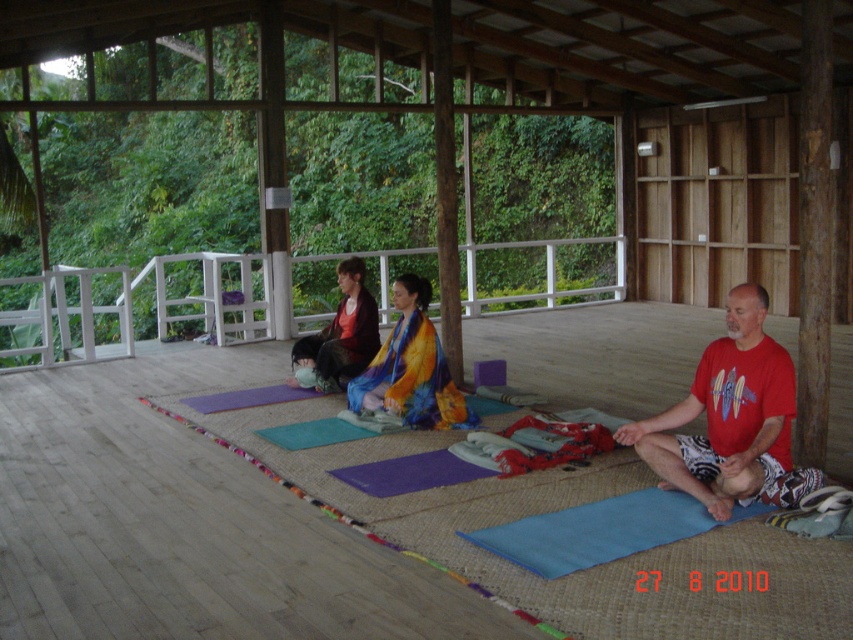
Question: Which of the following is the closest to the observer?

Choices:
 (A) (254, 280)
 (B) (728, 432)
 (C) (396, 349)
 (D) (317, 353)

Answer: (B)

Question: Does red cotton t-shirt at center appear under matte red sweater at center?

Choices:
 (A) yes
 (B) no

Answer: (A)

Question: Which object is the farthest from the red cotton t-shirt at center?

Choices:
 (A) multicolored fabric at center
 (B) white wooden railing at upper center
 (C) matte red sweater at center

Answer: (B)

Question: Can you confirm if multicolored fabric at center is positioned to the right of matte red sweater at center?

Choices:
 (A) yes
 (B) no

Answer: (A)

Question: Is multicolored fabric at center closer to the viewer compared to matte red sweater at center?

Choices:
 (A) no
 (B) yes

Answer: (B)

Question: Which point is closer to the camera?

Choices:
 (A) matte red sweater at center
 (B) red cotton t-shirt at center

Answer: (B)